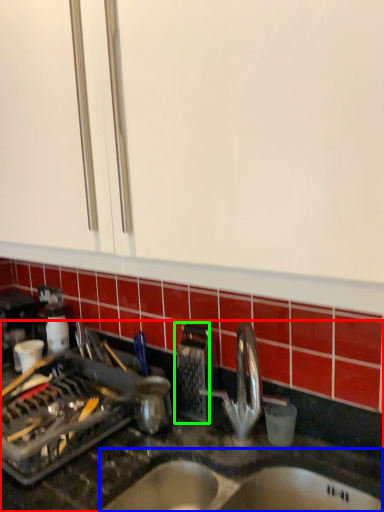
Question: Which is farther away from countertop (highlighted by a red box)? sink (highlighted by a blue box) or appliance (highlighted by a green box)?

Choices:
 (A) sink
 (B) appliance

Answer: (B)